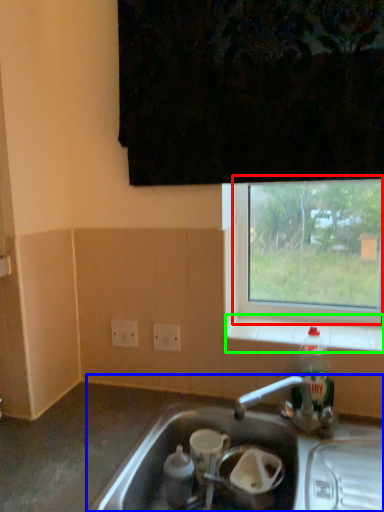
Question: Considering the real-world distances, which object is closest to window (highlighted by a red box)? sink (highlighted by a blue box) or window sill (highlighted by a green box).

Choices:
 (A) sink
 (B) window sill

Answer: (B)